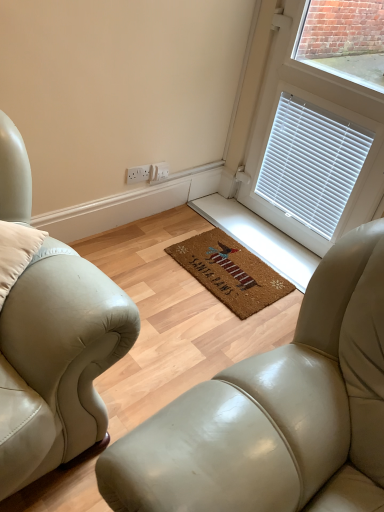
Where is `free space to the left of brown coir mat at center`? free space to the left of brown coir mat at center is located at coordinates (155, 256).